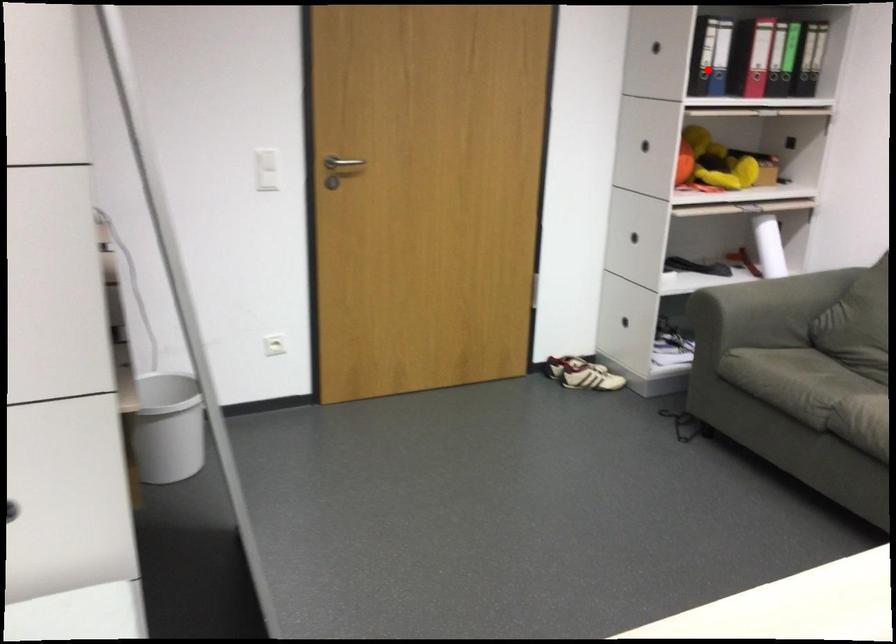
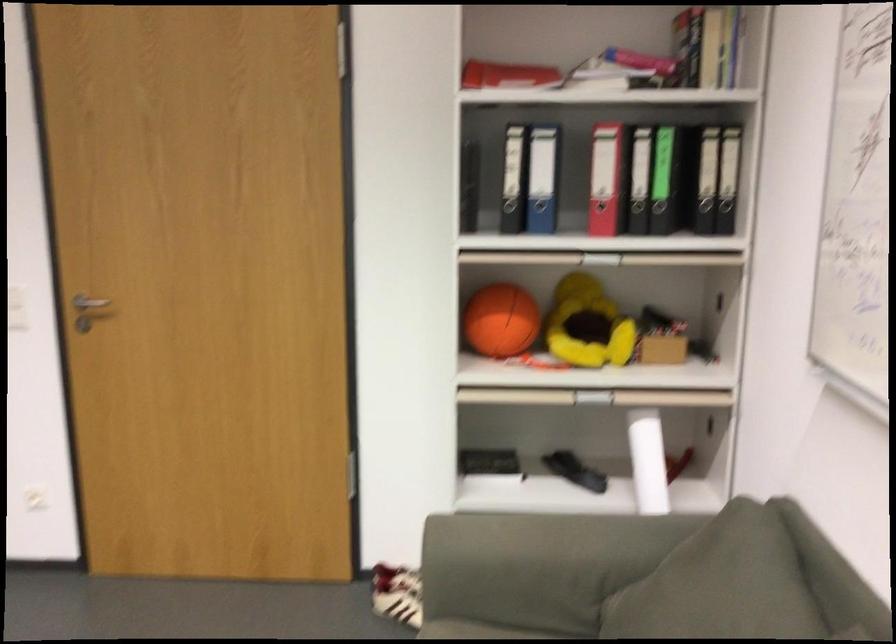
Question: I am providing you with two images of the same scene from different viewpoints. A red point is shown in image1. For the corresponding object point in image2, is it positioned nearer or farther from the camera?

Choices:
 (A) Nearer
 (B) Farther

Answer: (A)